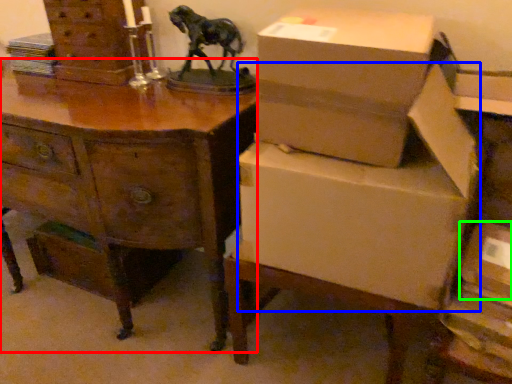
Question: Based on their relative distances, which object is farther from desk (highlighted by a red box)? Choose from cardboard box (highlighted by a blue box) and storage box (highlighted by a green box).

Choices:
 (A) cardboard box
 (B) storage box

Answer: (B)